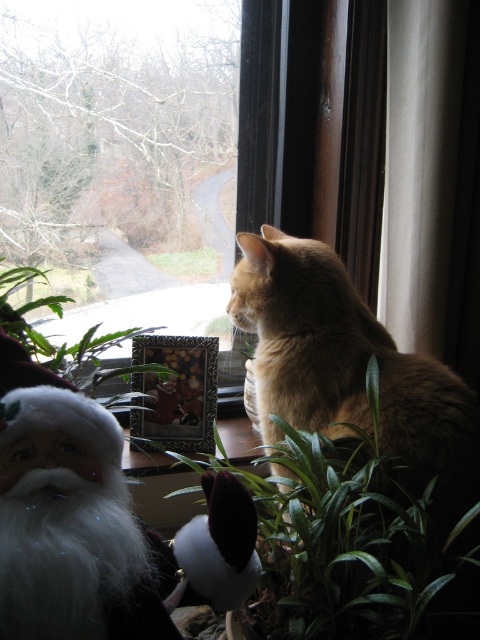
Does green leafy plant at center have a lesser width compared to white plush santa at lower left?

No, green leafy plant at center is not thinner than white plush santa at lower left.

Who is more distant from viewer, (436,529) or (7,358)?

The point (436,529) is behind.

Find the location of a particular element. The width and height of the screenshot is (480, 640). green leafy plant at center is located at coordinates (360, 545).

Which of these two, golden fur cat at window or white plush santa at lower left, stands taller?

With more height is golden fur cat at window.

Between point (435, 492) and point (154, 588), which one is positioned behind?

The point (435, 492) is behind.

Identify the location of golden fur cat at window. The height and width of the screenshot is (640, 480). (349, 369).

Can you confirm if green leafy plant at center is wider than green leafy plant at lower center?

Yes, green leafy plant at center is wider than green leafy plant at lower center.

Is green leafy plant at center to the left of green leafy plant at lower center from the viewer's perspective?

In fact, green leafy plant at center is to the right of green leafy plant at lower center.

Who is more forward, (269, 483) or (119, 376)?

Positioned in front is point (269, 483).

The image size is (480, 640). Identify the location of green leafy plant at center. (360, 545).